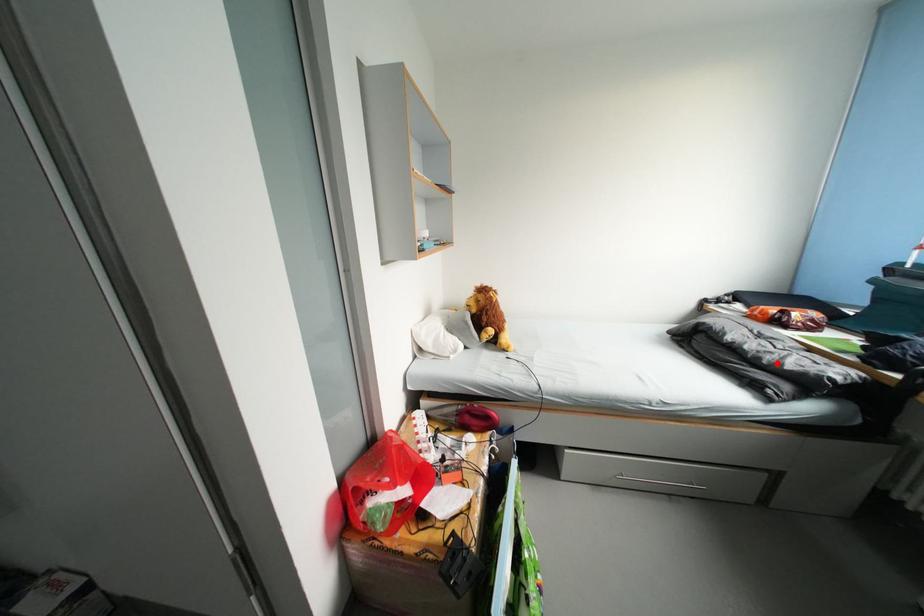
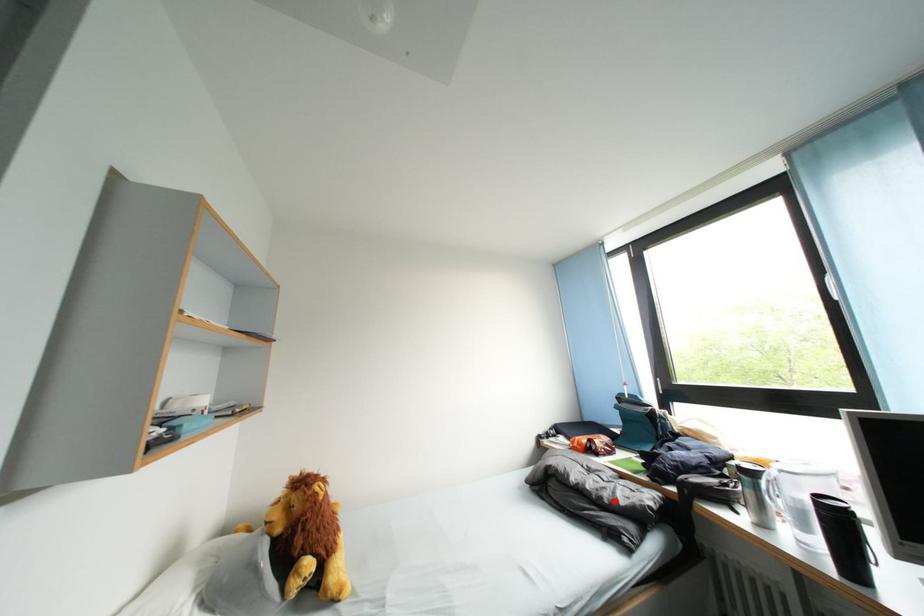
I am providing you with two images of the same scene from different viewpoints. A red point is marked on the first image and another point is marked on the second image. Does the point marked in image1 correspond to the same location as the one in image2?

Yes